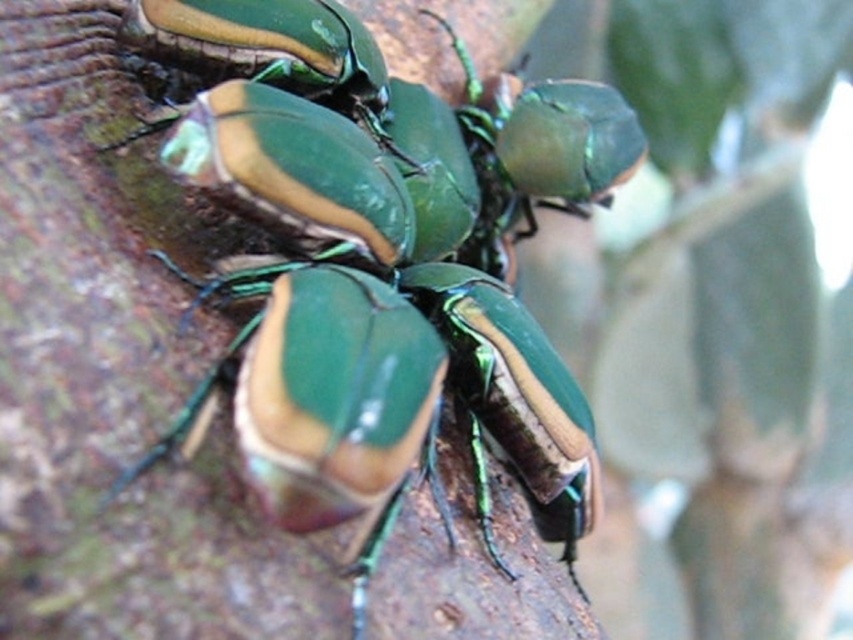
Question: Which point appears farthest from the camera in this image?

Choices:
 (A) (345, 300)
 (B) (625, 134)

Answer: (B)

Question: Is metallic green beetle at center bigger than metallic green beetle at upper center?

Choices:
 (A) yes
 (B) no

Answer: (A)

Question: Which point is farther from the camera taking this photo?

Choices:
 (A) (521, 189)
 (B) (289, 522)

Answer: (A)

Question: Can you confirm if metallic green beetle at center is positioned to the left of metallic green beetle at upper center?

Choices:
 (A) no
 (B) yes

Answer: (B)

Question: Where is metallic green beetle at center located in relation to metallic green beetle at upper center in the image?

Choices:
 (A) right
 (B) left

Answer: (B)